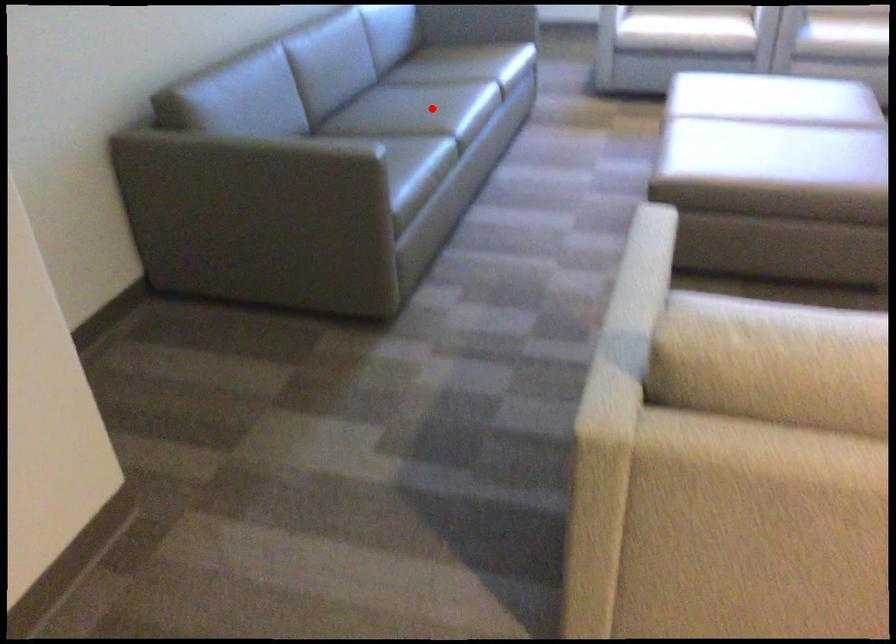
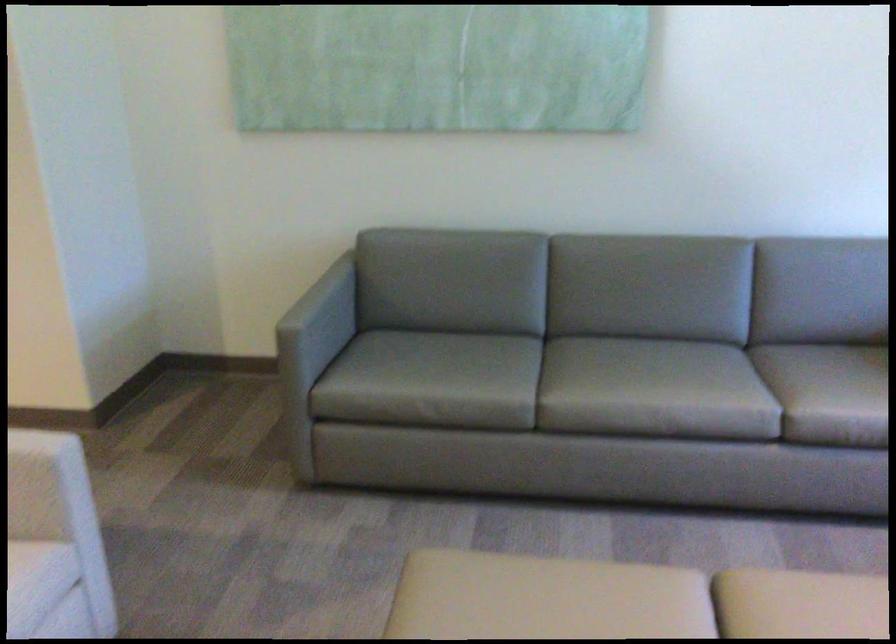
Find the pixel in the second image that matches the highlighted location in the first image.

(613, 386)